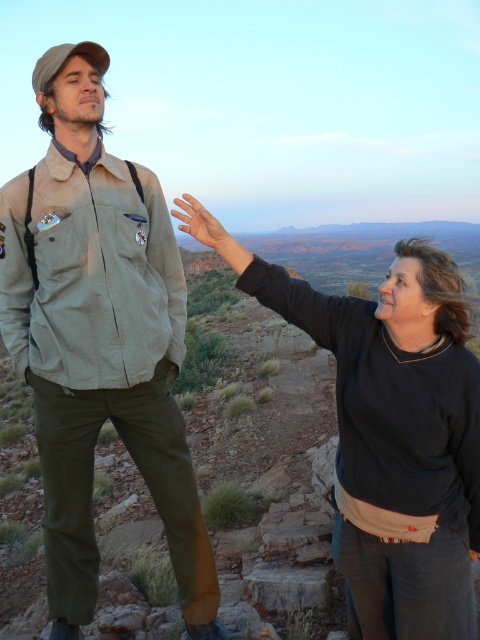
Question: Which of these objects is positioned farthest from the black matte sweater at upper right?

Choices:
 (A) khaki fabric jacket at left
 (B) black matte arm at upper center
 (C) matte skin hand at center

Answer: (C)

Question: Is khaki fabric jacket at left above black matte sweater at upper right?

Choices:
 (A) yes
 (B) no

Answer: (A)

Question: Which of these objects is positioned farthest from the matte skin hand at center?

Choices:
 (A) khaki fabric jacket at left
 (B) black matte arm at upper center

Answer: (A)

Question: Which point is closer to the camera?

Choices:
 (A) black matte sweater at upper right
 (B) khaki fabric jacket at left

Answer: (A)

Question: Observing the image, what is the correct spatial positioning of khaki fabric jacket at left in reference to matte skin hand at center?

Choices:
 (A) left
 (B) right

Answer: (A)

Question: Is khaki fabric jacket at left in front of black matte arm at upper center?

Choices:
 (A) no
 (B) yes

Answer: (A)